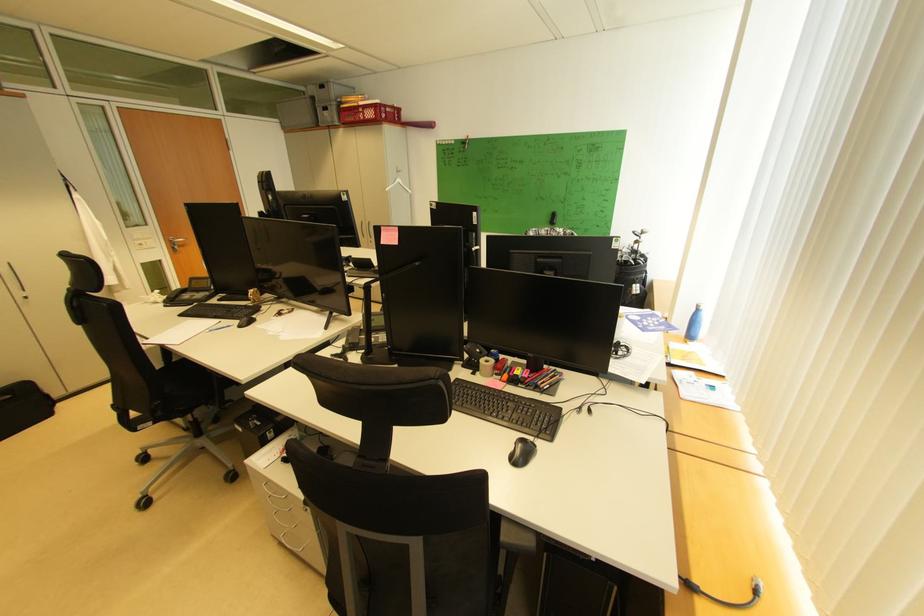
You are a GUI agent. You are given a task and a screenshot of the screen. Output one action in this format:
    pyautogui.click(x=<x>, y=<y>)
    Task: Click on the telephone handset
    
    Given the screenshot: What is the action you would take?
    pyautogui.click(x=175, y=297)